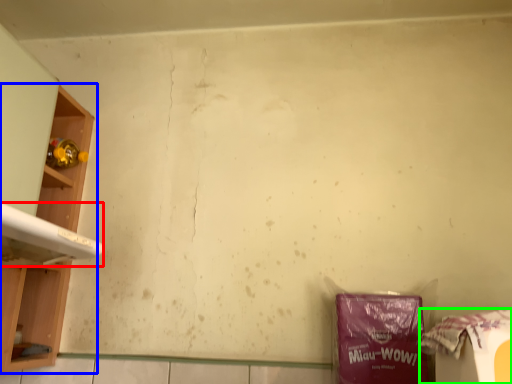
Question: Which object is positioned farthest from washing (highlighted by a red box)? Select from shelf (highlighted by a blue box) and waste (highlighted by a green box).

Choices:
 (A) shelf
 (B) waste

Answer: (B)